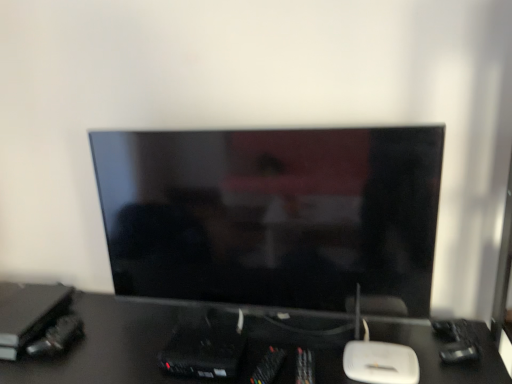
Question: Is black glossy desk at center taller or shorter than matte black monitor at center?

Choices:
 (A) tall
 (B) short

Answer: (B)

Question: Based on their sizes in the image, would you say black glossy desk at center is bigger or smaller than matte black monitor at center?

Choices:
 (A) small
 (B) big

Answer: (B)

Question: Is black glossy desk at center to the left or to the right of matte black monitor at center in the image?

Choices:
 (A) left
 (B) right

Answer: (A)

Question: From the image's perspective, is matte black monitor at center above or below black glossy desk at center?

Choices:
 (A) above
 (B) below

Answer: (A)

Question: Is matte black monitor at center wider or thinner than black glossy desk at center?

Choices:
 (A) wide
 (B) thin

Answer: (B)

Question: Would you say matte black monitor at center is inside or outside black glossy desk at center?

Choices:
 (A) inside
 (B) outside

Answer: (B)

Question: From their relative heights in the image, would you say matte black monitor at center is taller or shorter than black glossy desk at center?

Choices:
 (A) tall
 (B) short

Answer: (A)